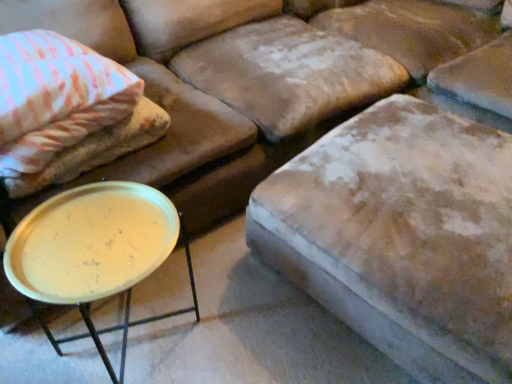
Question: From a real-world perspective, is pink striped fabric pillow at upper left on top of metallic gold tray at lower left?

Choices:
 (A) no
 (B) yes

Answer: (B)

Question: Considering the relative sizes of pink striped fabric pillow at upper left and metallic gold tray at lower left in the image provided, is pink striped fabric pillow at upper left thinner than metallic gold tray at lower left?

Choices:
 (A) no
 (B) yes

Answer: (A)

Question: Is metallic gold tray at lower left at the back of pink striped fabric pillow at upper left?

Choices:
 (A) no
 (B) yes

Answer: (A)

Question: Would you say pink striped fabric pillow at upper left is a long distance from metallic gold tray at lower left?

Choices:
 (A) no
 (B) yes

Answer: (A)

Question: Is pink striped fabric pillow at upper left at the right side of metallic gold tray at lower left?

Choices:
 (A) no
 (B) yes

Answer: (A)

Question: From the image's perspective, is pink striped fabric pillow at upper left under metallic gold tray at lower left?

Choices:
 (A) no
 (B) yes

Answer: (A)

Question: Is metallic gold tray at lower left outside velvet beige ottoman at center?

Choices:
 (A) yes
 (B) no

Answer: (A)

Question: From a real-world perspective, is metallic gold tray at lower left below velvet beige ottoman at center?

Choices:
 (A) no
 (B) yes

Answer: (A)

Question: Are metallic gold tray at lower left and velvet beige ottoman at center located far from each other?

Choices:
 (A) yes
 (B) no

Answer: (B)

Question: Does metallic gold tray at lower left have a greater width compared to velvet beige ottoman at center?

Choices:
 (A) no
 (B) yes

Answer: (A)

Question: Can you confirm if metallic gold tray at lower left is taller than velvet beige ottoman at center?

Choices:
 (A) yes
 (B) no

Answer: (A)

Question: Does metallic gold tray at lower left have a smaller size compared to velvet beige ottoman at center?

Choices:
 (A) yes
 (B) no

Answer: (A)

Question: Can you confirm if pink striped fabric pillow at upper left is positioned to the right of velvet beige ottoman at center?

Choices:
 (A) no
 (B) yes

Answer: (A)